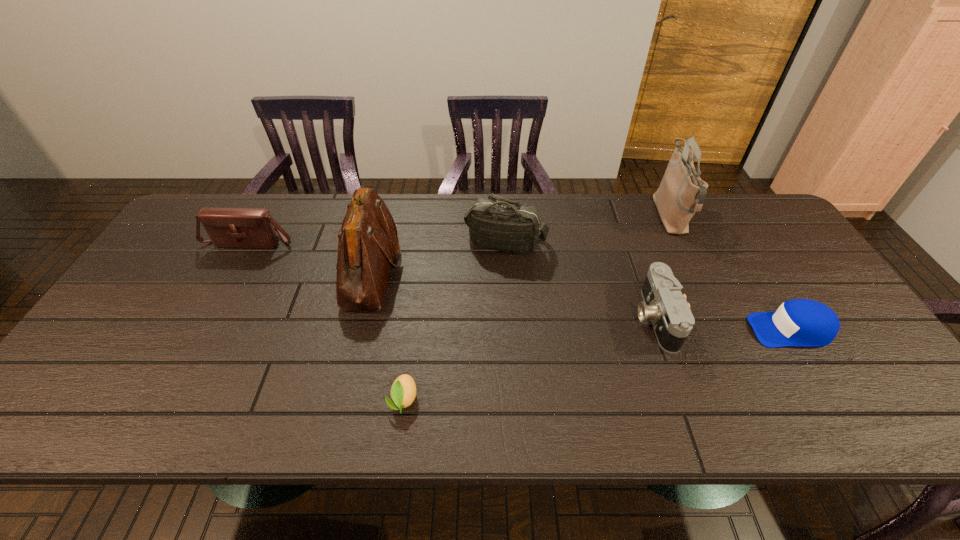
Where is `free spot located 0.190m on the lens of the fifth tallest object`? The image size is (960, 540). free spot located 0.190m on the lens of the fifth tallest object is located at coordinates (562, 318).

Identify the location of vacant space located 0.130m on the front-facing side of the rightmost object. (699, 330).

This screenshot has width=960, height=540. I want to click on vacant space situated on the front-facing side of the rightmost object, so click(659, 330).

At what (x,y) coordinates should I click in order to perform the action: click on free space located 0.240m on the front-facing side of the rightmost object. Please return your answer as a coordinate pair (x, y). Looking at the image, I should click on (655, 330).

In order to click on object that is at the near edge in this screenshot , I will do `click(403, 391)`.

The width and height of the screenshot is (960, 540). What are the coordinates of `object at the left edge` in the screenshot? It's located at (227, 227).

This screenshot has width=960, height=540. Identify the location of object at the right edge. (799, 322).

This screenshot has width=960, height=540. In order to click on object located at the far left corner in this screenshot , I will do `click(227, 227)`.

Locate an element on the screen. vacant space at the far edge of the desktop is located at coordinates (656, 229).

In the image, there is a desktop. Identify the location of vacant area at the near edge. (478, 423).